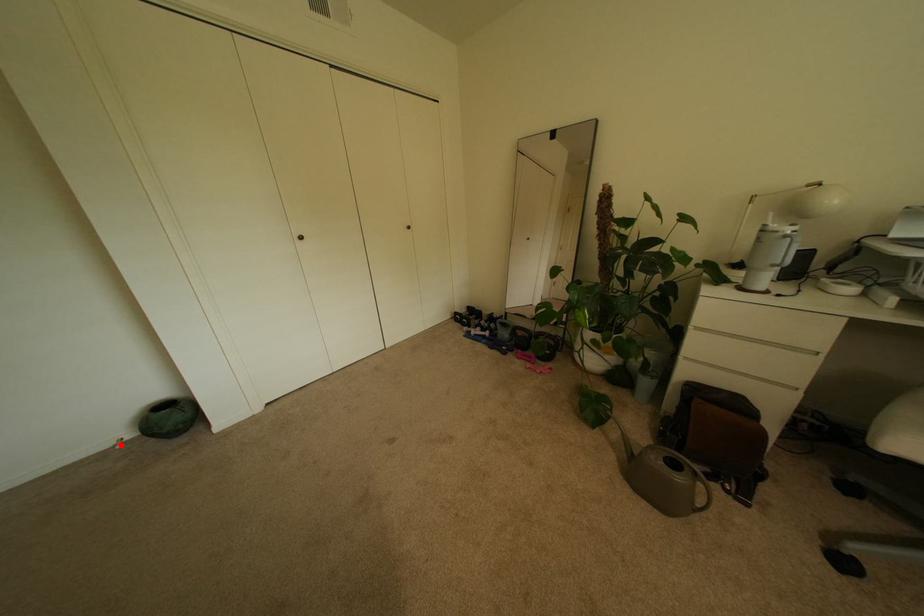
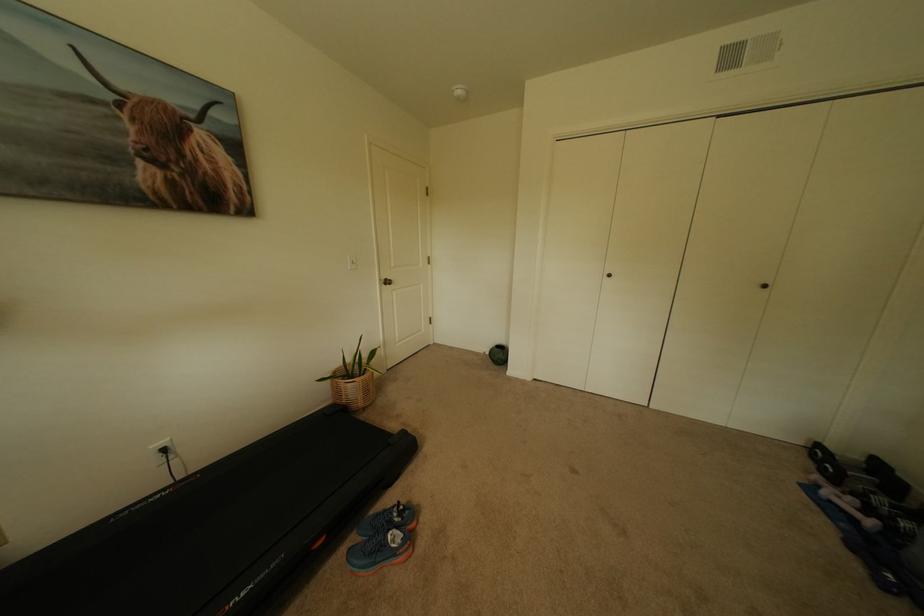
Question: I am providing you with two images of the same scene from different viewpoints. In image1, a red point is highlighted. Considering the same 3D point in image2, which of the following is correct?

Choices:
 (A) It is closer
 (B) It is farther

Answer: (B)